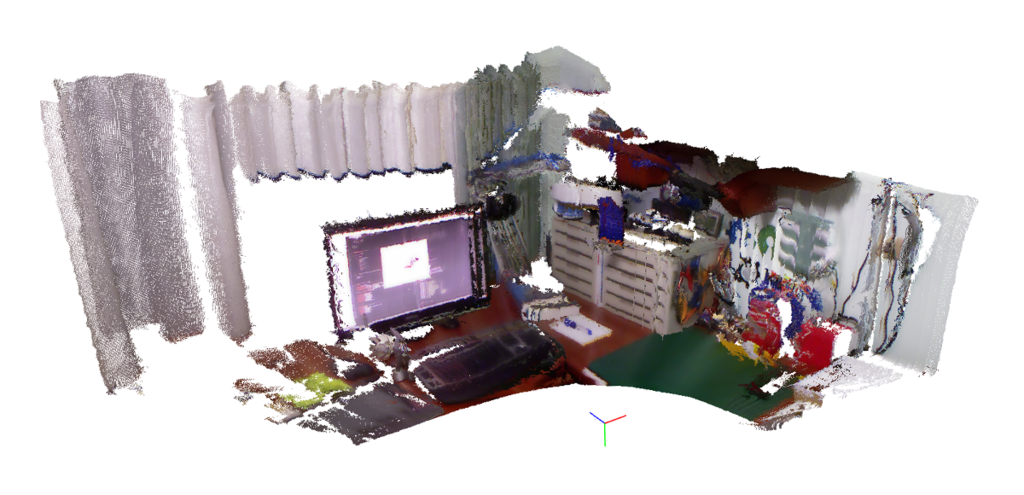
Locate an element on the screen. The image size is (1024, 495). illustrated gray metal file cabinet is located at coordinates (636, 271), (571, 249).